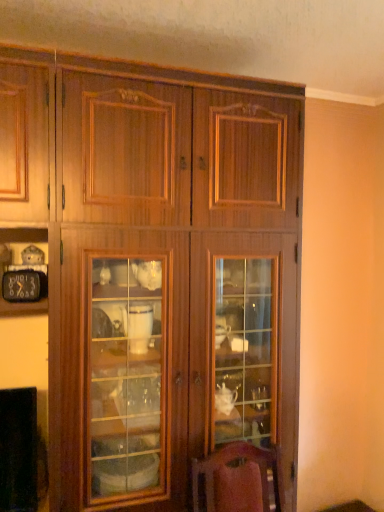
Question: From the image's perspective, is metallic black clock at left under wooden cabinet at center?

Choices:
 (A) no
 (B) yes

Answer: (A)

Question: Is metallic black clock at left wider than wooden cabinet at center?

Choices:
 (A) no
 (B) yes

Answer: (A)

Question: Is metallic black clock at left to the left of wooden cabinet at center from the viewer's perspective?

Choices:
 (A) yes
 (B) no

Answer: (A)

Question: Can you confirm if metallic black clock at left is shorter than wooden cabinet at center?

Choices:
 (A) yes
 (B) no

Answer: (A)

Question: Is there a large distance between metallic black clock at left and wooden cabinet at center?

Choices:
 (A) no
 (B) yes

Answer: (A)

Question: Does metallic black clock at left come in front of wooden cabinet at center?

Choices:
 (A) yes
 (B) no

Answer: (B)

Question: Is wooden cabinet at center to the right of metallic black clock at left from the viewer's perspective?

Choices:
 (A) no
 (B) yes

Answer: (B)

Question: Is the depth of wooden cabinet at center less than that of metallic black clock at left?

Choices:
 (A) yes
 (B) no

Answer: (A)

Question: Considering the relative sizes of wooden cabinet at center and metallic black clock at left in the image provided, is wooden cabinet at center smaller than metallic black clock at left?

Choices:
 (A) no
 (B) yes

Answer: (A)

Question: From the image's perspective, is wooden cabinet at center above metallic black clock at left?

Choices:
 (A) no
 (B) yes

Answer: (A)

Question: Is wooden cabinet at center shorter than metallic black clock at left?

Choices:
 (A) yes
 (B) no

Answer: (B)

Question: Is wooden cabinet at center thinner than metallic black clock at left?

Choices:
 (A) yes
 (B) no

Answer: (B)

Question: Is wooden cabinet at center situated inside metallic black clock at left or outside?

Choices:
 (A) outside
 (B) inside

Answer: (A)